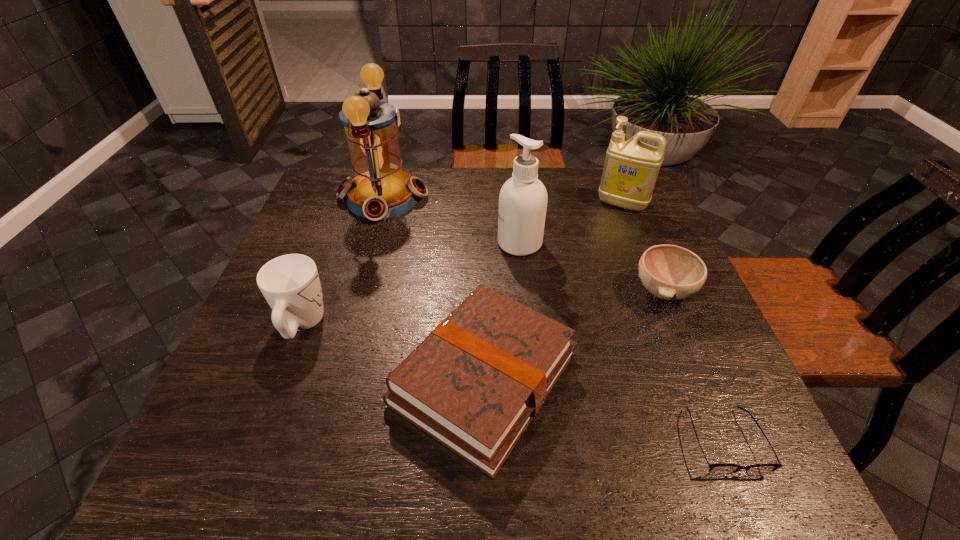
Locate an element on the screen. The width and height of the screenshot is (960, 540). blank area located 0.150m on the front label of the cleansing agent is located at coordinates (442, 244).

Locate an element on the screen. Image resolution: width=960 pixels, height=540 pixels. vacant space located on the front label of the cleansing agent is located at coordinates (475, 244).

Locate an element on the screen. Image resolution: width=960 pixels, height=540 pixels. vacant space located 0.050m on the back of the detergent is located at coordinates (614, 184).

You are a GUI agent. You are given a task and a screenshot of the screen. Output one action in this format:
    pyautogui.click(x=<x>, y=<y>)
    Task: Click on the vacant area situated on the side of the fourth shortest object with the handle
    The image size is (960, 540).
    Given the screenshot: What is the action you would take?
    pyautogui.click(x=327, y=256)

Image resolution: width=960 pixels, height=540 pixels. I want to click on vacant space located 0.300m on the side of the fourth shortest object with the handle, so click(x=341, y=221).

I want to click on blank space located on the side of the fourth shortest object with the handle, so click(x=329, y=251).

At what (x,y) coordinates should I click in order to perform the action: click on vacant area located on the back of the bowl. Please return your answer as a coordinate pair (x, y). Image resolution: width=960 pixels, height=540 pixels. Looking at the image, I should click on (621, 189).

Find the location of a particular element. This screenshot has width=960, height=540. blank space located 0.190m on the right of the hardback book is located at coordinates (674, 378).

Locate an element on the screen. The image size is (960, 540). lantern located at the far edge is located at coordinates (380, 189).

At what (x,y) coordinates should I click in order to perform the action: click on detergent positioned at the far edge. Please return your answer as a coordinate pair (x, y). The width and height of the screenshot is (960, 540). Looking at the image, I should click on (631, 168).